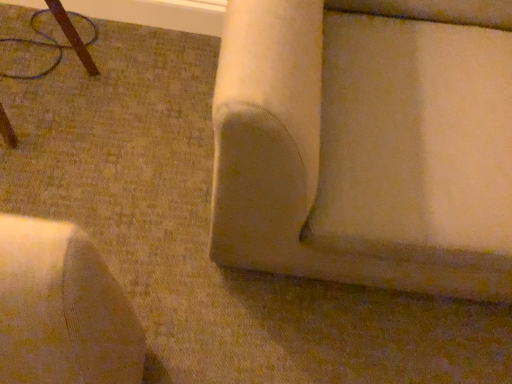
The image size is (512, 384). Identify the location of brown wood table at upper left, the 2th furniture positioned from the right. (74, 35).

In order to face brown wood table at upper left, the 2th furniture positioned from the right, should I rotate leftwards or rightwards?

Rotate left and turn 31.845 degrees.

The height and width of the screenshot is (384, 512). Describe the element at coordinates (74, 35) in the screenshot. I see `brown wood table at upper left, arranged as the first furniture when viewed from the left` at that location.

The height and width of the screenshot is (384, 512). Find the location of `beige fabric couch at center, acting as the 2th furniture starting from the left`. beige fabric couch at center, acting as the 2th furniture starting from the left is located at coordinates [x=366, y=146].

What do you see at coordinates (366, 146) in the screenshot?
I see `beige fabric couch at center, acting as the 2th furniture starting from the left` at bounding box center [366, 146].

Locate an element on the screen. This screenshot has height=384, width=512. brown wood table at upper left, arranged as the first furniture when viewed from the left is located at coordinates (74, 35).

Can you confirm if beige fabric couch at center, which is the first furniture from right to left, is positioned to the left of brown wood table at upper left, the 2th furniture positioned from the right?

In fact, beige fabric couch at center, which is the first furniture from right to left, is to the right of brown wood table at upper left, the 2th furniture positioned from the right.

Which object is closer to the camera taking this photo, beige fabric couch at center, which is the first furniture from right to left, or brown wood table at upper left, the 2th furniture positioned from the right?

beige fabric couch at center, which is the first furniture from right to left, is closer to the camera.

Is point (448, 286) closer or farther from the camera than point (52, 9)?

Point (448, 286) is positioned closer to the camera compared to point (52, 9).

From the image's perspective, between beige fabric couch at center, which is the first furniture from right to left, and brown wood table at upper left, the 2th furniture positioned from the right, who is located below?

beige fabric couch at center, which is the first furniture from right to left, appears lower in the image.

From a real-world perspective, which is physically above, beige fabric couch at center, which is the first furniture from right to left, or brown wood table at upper left, arranged as the first furniture when viewed from the left?

From a 3D spatial view, beige fabric couch at center, which is the first furniture from right to left, is above.

Can you confirm if beige fabric couch at center, acting as the 2th furniture starting from the left, is thinner than brown wood table at upper left, the 2th furniture positioned from the right?

Incorrect, the width of beige fabric couch at center, acting as the 2th furniture starting from the left, is not less than that of brown wood table at upper left, the 2th furniture positioned from the right.

From their relative heights in the image, would you say beige fabric couch at center, acting as the 2th furniture starting from the left, is taller or shorter than brown wood table at upper left, arranged as the first furniture when viewed from the left?

Clearly, beige fabric couch at center, acting as the 2th furniture starting from the left, is taller compared to brown wood table at upper left, arranged as the first furniture when viewed from the left.

Between beige fabric couch at center, which is the first furniture from right to left, and brown wood table at upper left, the 2th furniture positioned from the right, which one has smaller size?

With smaller size is brown wood table at upper left, the 2th furniture positioned from the right.

Can we say beige fabric couch at center, which is the first furniture from right to left, lies outside brown wood table at upper left, the 2th furniture positioned from the right?

Yes.

Is beige fabric couch at center, which is the first furniture from right to left, next to brown wood table at upper left, arranged as the first furniture when viewed from the left?

No, beige fabric couch at center, which is the first furniture from right to left, is not in contact with brown wood table at upper left, arranged as the first furniture when viewed from the left.

From the picture: Is beige fabric couch at center, which is the first furniture from right to left, looking in the opposite direction of brown wood table at upper left, arranged as the first furniture when viewed from the left?

beige fabric couch at center, which is the first furniture from right to left, does not have its back to brown wood table at upper left, arranged as the first furniture when viewed from the left.

How many degrees apart are the facing directions of beige fabric couch at center, acting as the 2th furniture starting from the left, and brown wood table at upper left, arranged as the first furniture when viewed from the left?

The angle between the facing direction of beige fabric couch at center, acting as the 2th furniture starting from the left, and the facing direction of brown wood table at upper left, arranged as the first furniture when viewed from the left, is 61.1 degrees.

In order to click on furniture below the beige fabric couch at center, acting as the 2th furniture starting from the left (from a real-world perspective) in this screenshot , I will do `click(74, 35)`.

Considering the positions of objects brown wood table at upper left, arranged as the first furniture when viewed from the left, and beige fabric couch at center, acting as the 2th furniture starting from the left, in the image provided, who is more to the left, brown wood table at upper left, arranged as the first furniture when viewed from the left, or beige fabric couch at center, acting as the 2th furniture starting from the left,?

brown wood table at upper left, arranged as the first furniture when viewed from the left, is more to the left.

Which object is more forward, brown wood table at upper left, the 2th furniture positioned from the right, or beige fabric couch at center, acting as the 2th furniture starting from the left?

Positioned in front is beige fabric couch at center, acting as the 2th furniture starting from the left.

Considering the points (93, 69) and (286, 261), which point is behind, point (93, 69) or point (286, 261)?

Point (93, 69)

From the image's perspective, is brown wood table at upper left, arranged as the first furniture when viewed from the left, under beige fabric couch at center, acting as the 2th furniture starting from the left?

No, from the image's perspective, brown wood table at upper left, arranged as the first furniture when viewed from the left, is not beneath beige fabric couch at center, acting as the 2th furniture starting from the left.

From a real-world perspective, is brown wood table at upper left, arranged as the first furniture when viewed from the left, beneath beige fabric couch at center, which is the first furniture from right to left?

Yes, from a real-world perspective, brown wood table at upper left, arranged as the first furniture when viewed from the left, is below beige fabric couch at center, which is the first furniture from right to left.

Can you confirm if brown wood table at upper left, the 2th furniture positioned from the right, is thinner than beige fabric couch at center, acting as the 2th furniture starting from the left?

Indeed, brown wood table at upper left, the 2th furniture positioned from the right, has a lesser width compared to beige fabric couch at center, acting as the 2th furniture starting from the left.

Can you confirm if brown wood table at upper left, the 2th furniture positioned from the right, is taller than beige fabric couch at center, which is the first furniture from right to left?

Incorrect, the height of brown wood table at upper left, the 2th furniture positioned from the right, is not larger of that of beige fabric couch at center, which is the first furniture from right to left.

Based on their sizes in the image, would you say brown wood table at upper left, arranged as the first furniture when viewed from the left, is bigger or smaller than beige fabric couch at center, which is the first furniture from right to left?

brown wood table at upper left, arranged as the first furniture when viewed from the left, is smaller than beige fabric couch at center, which is the first furniture from right to left.

Can beige fabric couch at center, acting as the 2th furniture starting from the left, be found inside brown wood table at upper left, arranged as the first furniture when viewed from the left?

No, beige fabric couch at center, acting as the 2th furniture starting from the left, is not a part of brown wood table at upper left, arranged as the first furniture when viewed from the left.

Is brown wood table at upper left, the 2th furniture positioned from the right, far from beige fabric couch at center, which is the first furniture from right to left?

No, brown wood table at upper left, the 2th furniture positioned from the right, is not far away from beige fabric couch at center, which is the first furniture from right to left.

Is brown wood table at upper left, arranged as the first furniture when viewed from the left, turned away from beige fabric couch at center, acting as the 2th furniture starting from the left?

No.

Find the location of a particular element. The image size is (512, 384). furniture on the right of brown wood table at upper left, arranged as the first furniture when viewed from the left is located at coordinates (366, 146).

Image resolution: width=512 pixels, height=384 pixels. In the image, there is a beige fabric couch at center, acting as the 2th furniture starting from the left. What are the coordinates of `furniture below it (from a real-world perspective)` in the screenshot? It's located at (74, 35).

Image resolution: width=512 pixels, height=384 pixels. Identify the location of furniture behind the beige fabric couch at center, which is the first furniture from right to left. (74, 35).